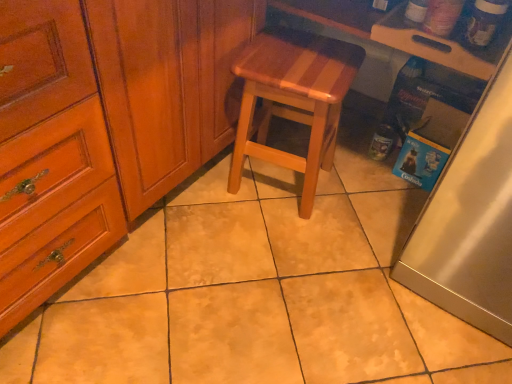
This screenshot has height=384, width=512. In order to click on vacant area that lies between satin silver fridge at right and natural wood stool at center in this screenshot , I will do `click(358, 213)`.